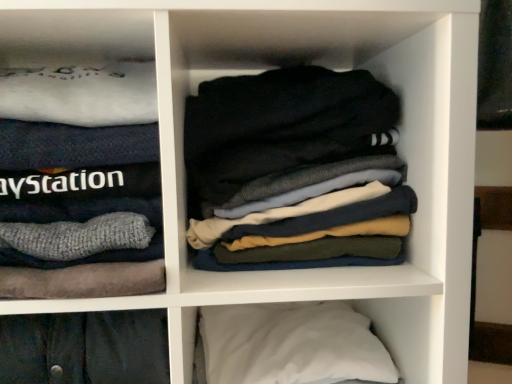
The width and height of the screenshot is (512, 384). In order to click on white soft sweater at left in this screenshot , I will do `click(83, 281)`.

This screenshot has height=384, width=512. Identify the location of white soft pillow at lower right. (291, 344).

The image size is (512, 384). Identify the location of dark gray cotton socks at center. (301, 167).

Find the location of a particular element. Image resolution: width=512 pixels, height=384 pixels. white soft sweater at left is located at coordinates (83, 281).

Considering their positions, is white soft sweater at left located in front of or behind dark gray cotton socks at center?

Clearly, white soft sweater at left is in front of dark gray cotton socks at center.

Measure the distance between white soft sweater at left and dark gray cotton socks at center.

white soft sweater at left is 7.12 inches away from dark gray cotton socks at center.

Considering the relative sizes of white soft sweater at left and dark gray cotton socks at center in the image provided, is white soft sweater at left thinner than dark gray cotton socks at center?

No.

Is white soft sweater at left looking in the opposite direction of dark gray cotton socks at center?

No, white soft sweater at left is not facing the opposite direction of dark gray cotton socks at center.

Between dark gray cotton socks at center and white soft pillow at lower right, which one has less height?

white soft pillow at lower right.

Looking at this image, is dark gray cotton socks at center further to the viewer compared to white soft pillow at lower right?

Yes.

How distant is dark gray cotton socks at center from white soft pillow at lower right?

A distance of 10.01 inches exists between dark gray cotton socks at center and white soft pillow at lower right.

Looking at this image, from a real-world perspective, does dark gray cotton socks at center stand above white soft pillow at lower right?

Indeed, from a real-world perspective, dark gray cotton socks at center stands above white soft pillow at lower right.

Can you confirm if dark gray cotton socks at center is wider than white soft sweater at left?

Incorrect, the width of dark gray cotton socks at center does not surpass that of white soft sweater at left.

Would you say dark gray cotton socks at center is inside or outside white soft sweater at left?

dark gray cotton socks at center exists outside the volume of white soft sweater at left.

Find the location of a particular element. laundry that appears on the right of white soft sweater at left is located at coordinates (301, 167).

From the picture: What's the angular difference between dark gray cotton socks at center and white soft sweater at left's facing directions?

The angular difference between dark gray cotton socks at center and white soft sweater at left is 0.000173 degrees.

Is white soft sweater at left inside white soft pillow at lower right?

No, white soft sweater at left is not surrounded by white soft pillow at lower right.

Which object is thinner, white soft pillow at lower right or white soft sweater at left?

With smaller width is white soft sweater at left.

From the image's perspective, does white soft pillow at lower right appear higher than white soft sweater at left?

Incorrect, from the image's perspective, white soft pillow at lower right is lower than white soft sweater at left.

Can you confirm if white soft pillow at lower right is positioned to the left of white soft sweater at left?

In fact, white soft pillow at lower right is to the right of white soft sweater at left.

Are white soft pillow at lower right and dark gray cotton socks at center beside each other?

No.

I want to click on laundry that appears above the white soft pillow at lower right (from the image's perspective), so click(301, 167).

Does white soft pillow at lower right lie behind dark gray cotton socks at center?

No, it is not.

Is white soft pillow at lower right oriented away from dark gray cotton socks at center?

No, dark gray cotton socks at center is not at the back of white soft pillow at lower right.

Considering the positions of objects white soft sweater at left and white soft pillow at lower right in the image provided, who is more to the right, white soft sweater at left or white soft pillow at lower right?

white soft pillow at lower right is more to the right.

Does point (174, 270) appear closer or farther from the camera than point (236, 367)?

Point (174, 270) is positioned closer to the camera compared to point (236, 367).

From a real-world perspective, is white soft sweater at left above or below white soft pillow at lower right?

In terms of real-world spatial position, white soft sweater at left is above white soft pillow at lower right.

Locate an element on the screen. cabinet above the dark gray cotton socks at center (from a real-world perspective) is located at coordinates (83, 281).

Where is `laundry located above the white soft pillow at lower right (from the image's perspective)`? Image resolution: width=512 pixels, height=384 pixels. laundry located above the white soft pillow at lower right (from the image's perspective) is located at coordinates (301, 167).

Which object lies nearer to the anchor point white soft pillow at lower right, dark gray cotton socks at center or white soft sweater at left?

dark gray cotton socks at center.

Based on their spatial positions, is white soft pillow at lower right or white soft sweater at left closer to dark gray cotton socks at center?

Based on the image, white soft sweater at left appears to be nearer to dark gray cotton socks at center.

Considering their positions, is white soft sweater at left positioned closer to white soft pillow at lower right than dark gray cotton socks at center?

Among the two, dark gray cotton socks at center is located nearer to white soft pillow at lower right.

When comparing their distances from white soft sweater at left, does dark gray cotton socks at center or white soft pillow at lower right seem further?

Among the two, white soft pillow at lower right is located further to white soft sweater at left.

Looking at the image, which one is located further to dark gray cotton socks at center, white soft sweater at left or white soft pillow at lower right?

The object further to dark gray cotton socks at center is white soft pillow at lower right.

From the picture: From the image, which object appears to be farther from white soft sweater at left, white soft pillow at lower right or dark gray cotton socks at center?

white soft pillow at lower right is positioned further to the anchor white soft sweater at left.

In order to click on cabinet between dark gray cotton socks at center and white soft pillow at lower right vertically in this screenshot , I will do `click(83, 281)`.